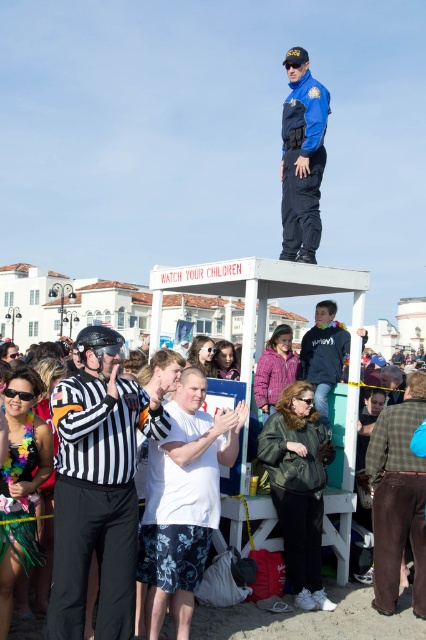
Is point (172, 508) positioned in front of point (302, 86)?

Yes, point (172, 508) is in front of point (302, 86).

Can you confirm if white floral shorts at center is bigger than blue uniform at upper center?

No, white floral shorts at center is not bigger than blue uniform at upper center.

Is point (235, 417) more distant than point (313, 188)?

No, (235, 417) is closer to viewer.

Locate an element on the screen. The height and width of the screenshot is (640, 426). white floral shorts at center is located at coordinates (184, 500).

Is black striped shirt at center below white floral shorts at center?

No.

Does point (120, 586) come in front of point (152, 477)?

Yes.

The image size is (426, 640). I want to click on black striped shirt at center, so click(x=97, y=486).

Is point (189, 545) more distant than point (396, 536)?

No.

Is point (175, 476) less distant than point (394, 572)?

Yes, point (175, 476) is in front of point (394, 572).

Where is `white floral shorts at center`? The image size is (426, 640). white floral shorts at center is located at coordinates (184, 500).